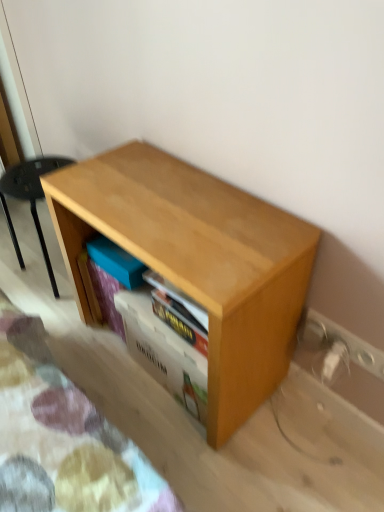
At what (x,y) coordinates should I click in order to perform the action: click on white plastic electric outlet at lower right, which is counted as the second electric outlet, starting from the bottom. Please return your answer as a coordinate pair (x, y). This screenshot has height=512, width=384. Looking at the image, I should click on pyautogui.click(x=313, y=333).

What do you see at coordinates (335, 362) in the screenshot?
I see `white plastic electric outlet at lower right, which ranks as the 1th electric outlet in bottom-to-top order` at bounding box center [335, 362].

How much space does white plastic electric outlet at lower right, which is the 2th electric outlet from top to bottom, occupy vertically?

7.86 centimeters.

The height and width of the screenshot is (512, 384). In order to click on light wood shelf at lower left in this screenshot , I will do click(30, 198).

Describe the element at coordinates (197, 261) in the screenshot. I see `light wood table at center` at that location.

Find the location of a particular element. light wood table at center is located at coordinates (197, 261).

What do you see at coordinates (164, 352) in the screenshot?
I see `wooden shelf at center` at bounding box center [164, 352].

Where is `white plastic electric outlet at lower right, which ranks as the 1th electric outlet in top-to-bottom order`? Image resolution: width=384 pixels, height=512 pixels. white plastic electric outlet at lower right, which ranks as the 1th electric outlet in top-to-bottom order is located at coordinates (313, 333).

Is light wood shelf at lower left placed right next to wooden shelf at center?

No, light wood shelf at lower left is not next to wooden shelf at center.

Is light wood shelf at lower left oriented towards wooden shelf at center?

No, light wood shelf at lower left is not oriented towards wooden shelf at center.

Consider the image. From the image's perspective, is light wood shelf at lower left under wooden shelf at center?

No.

Based on their positions, is light wood table at center located to the left or right of white plastic electric outlet at lower right, which ranks as the 1th electric outlet in bottom-to-top order?

Based on their positions, light wood table at center is located to the left of white plastic electric outlet at lower right, which ranks as the 1th electric outlet in bottom-to-top order.

Is light wood table at center completely or partially outside of white plastic electric outlet at lower right, which is the 2th electric outlet from top to bottom?

light wood table at center lies outside white plastic electric outlet at lower right, which is the 2th electric outlet from top to bottom,'s area.

From a real-world perspective, between light wood table at center and white plastic electric outlet at lower right, which ranks as the 1th electric outlet in bottom-to-top order, who is vertically higher?

From a 3D spatial view, light wood table at center is above.

At what (x,y) coordinates should I click in order to perform the action: click on electric outlet above the white plastic electric outlet at lower right, which ranks as the 1th electric outlet in bottom-to-top order (from a real-world perspective). Please return your answer as a coordinate pair (x, y). Looking at the image, I should click on (313, 333).

Considering the relative sizes of white plastic electric outlet at lower right, which ranks as the 1th electric outlet in top-to-bottom order, and white plastic electric outlet at lower right, which is the 2th electric outlet from top to bottom, in the image provided, is white plastic electric outlet at lower right, which ranks as the 1th electric outlet in top-to-bottom order, smaller than white plastic electric outlet at lower right, which is the 2th electric outlet from top to bottom,?

Yes, white plastic electric outlet at lower right, which ranks as the 1th electric outlet in top-to-bottom order, is smaller than white plastic electric outlet at lower right, which is the 2th electric outlet from top to bottom.

In the image, is white plastic electric outlet at lower right, which is counted as the second electric outlet, starting from the bottom, positioned in front of or behind white plastic electric outlet at lower right, which is the 2th electric outlet from top to bottom?

Clearly, white plastic electric outlet at lower right, which is counted as the second electric outlet, starting from the bottom, is behind white plastic electric outlet at lower right, which is the 2th electric outlet from top to bottom.

Does wooden shelf at center turn towards white plastic electric outlet at lower right, which is counted as the second electric outlet, starting from the bottom?

No, wooden shelf at center does not turn towards white plastic electric outlet at lower right, which is counted as the second electric outlet, starting from the bottom.

Identify the location of the 2nd electric outlet behind the wooden shelf at center. This screenshot has height=512, width=384. (313, 333).

From a real-world perspective, is wooden shelf at center beneath white plastic electric outlet at lower right, which is counted as the second electric outlet, starting from the bottom?

Indeed, from a real-world perspective, wooden shelf at center is positioned beneath white plastic electric outlet at lower right, which is counted as the second electric outlet, starting from the bottom.

How much distance is there between wooden shelf at center and white plastic electric outlet at lower right, which ranks as the 1th electric outlet in top-to-bottom order?

The distance of wooden shelf at center from white plastic electric outlet at lower right, which ranks as the 1th electric outlet in top-to-bottom order, is 16.59 inches.

Is wooden shelf at center completely or partially outside of light wood table at center?

No, most part of wooden shelf at center lies within light wood table at center.

How many degrees apart are the facing directions of wooden shelf at center and light wood table at center?

There is a 2.06e-05-degree angle between the facing directions of wooden shelf at center and light wood table at center.

Is light wood table at center at the back of wooden shelf at center?

Yes, light wood table at center is at the back of wooden shelf at center.

Which object is positioned more to the left, wooden shelf at center or light wood table at center?

light wood table at center is more to the left.

Does white plastic electric outlet at lower right, which ranks as the 1th electric outlet in top-to-bottom order, have a greater width compared to light wood shelf at lower left?

No.

Is white plastic electric outlet at lower right, which ranks as the 1th electric outlet in top-to-bottom order, looking in the opposite direction of light wood shelf at lower left?

No, white plastic electric outlet at lower right, which ranks as the 1th electric outlet in top-to-bottom order, is not facing away from light wood shelf at lower left.

Is white plastic electric outlet at lower right, which ranks as the 1th electric outlet in top-to-bottom order, not within light wood shelf at lower left?

That's correct, white plastic electric outlet at lower right, which ranks as the 1th electric outlet in top-to-bottom order, is outside of light wood shelf at lower left.

Does point (304, 327) come behind point (33, 203)?

No.

Measure the distance between light wood table at center and white plastic electric outlet at lower right, which ranks as the 1th electric outlet in top-to-bottom order.

light wood table at center is 15.41 inches from white plastic electric outlet at lower right, which ranks as the 1th electric outlet in top-to-bottom order.

From a real-world perspective, count 1st electric outlets downward from the light wood table at center and point to it. Please provide its 2D coordinates.

[(313, 333)]

Is light wood table at center spatially inside white plastic electric outlet at lower right, which ranks as the 1th electric outlet in top-to-bottom order, or outside of it?

The correct answer is: outside.

In order to click on furniture behind the wooden shelf at center in this screenshot , I will do [x=30, y=198].

I want to click on table above the white plastic electric outlet at lower right, which is the 2th electric outlet from top to bottom (from a real-world perspective), so click(197, 261).

Based on their spatial positions, is wooden shelf at center or light wood shelf at lower left further from white plastic electric outlet at lower right, which is the 2th electric outlet from top to bottom?

Based on the image, light wood shelf at lower left appears to be further to white plastic electric outlet at lower right, which is the 2th electric outlet from top to bottom.

Based on their spatial positions, is white plastic electric outlet at lower right, which is counted as the second electric outlet, starting from the bottom, or wooden shelf at center closer to light wood table at center?

wooden shelf at center is positioned closer to the anchor light wood table at center.

Which object lies further to the anchor point white plastic electric outlet at lower right, which is the 2th electric outlet from top to bottom, light wood table at center or light wood shelf at lower left?

The object further to white plastic electric outlet at lower right, which is the 2th electric outlet from top to bottom, is light wood shelf at lower left.

Looking at the image, which one is located further to white plastic electric outlet at lower right, which ranks as the 1th electric outlet in bottom-to-top order, wooden shelf at center or white plastic electric outlet at lower right, which ranks as the 1th electric outlet in top-to-bottom order?

wooden shelf at center.

Looking at the image, which one is located further to white plastic electric outlet at lower right, which ranks as the 1th electric outlet in top-to-bottom order, light wood shelf at lower left or light wood table at center?

Based on the image, light wood shelf at lower left appears to be further to white plastic electric outlet at lower right, which ranks as the 1th electric outlet in top-to-bottom order.

Based on their spatial positions, is white plastic electric outlet at lower right, which ranks as the 1th electric outlet in bottom-to-top order, or white plastic electric outlet at lower right, which is counted as the second electric outlet, starting from the bottom, closer to light wood shelf at lower left?

white plastic electric outlet at lower right, which is counted as the second electric outlet, starting from the bottom, lies closer to light wood shelf at lower left than the other object.

When comparing their distances from white plastic electric outlet at lower right, which ranks as the 1th electric outlet in top-to-bottom order, does wooden shelf at center or light wood table at center seem further?

wooden shelf at center.

Looking at the image, which one is located closer to wooden shelf at center, white plastic electric outlet at lower right, which is the 2th electric outlet from top to bottom, or light wood shelf at lower left?

Among the two, white plastic electric outlet at lower right, which is the 2th electric outlet from top to bottom, is located nearer to wooden shelf at center.

Find the location of `table between light wood shelf at lower left and white plastic electric outlet at lower right, which is the 2th electric outlet from top to bottom`. table between light wood shelf at lower left and white plastic electric outlet at lower right, which is the 2th electric outlet from top to bottom is located at coordinates (197, 261).

Find the location of a particular element. shelf situated between light wood shelf at lower left and white plastic electric outlet at lower right, which is the 2th electric outlet from top to bottom, from left to right is located at coordinates (164, 352).

Locate an element on the screen. The image size is (384, 512). electric outlet between wooden shelf at center and white plastic electric outlet at lower right, which ranks as the 1th electric outlet in bottom-to-top order is located at coordinates (313, 333).

Find the location of a particular element. Image resolution: width=384 pixels, height=512 pixels. electric outlet situated between light wood shelf at lower left and white plastic electric outlet at lower right, which is the 2th electric outlet from top to bottom, from left to right is located at coordinates (313, 333).